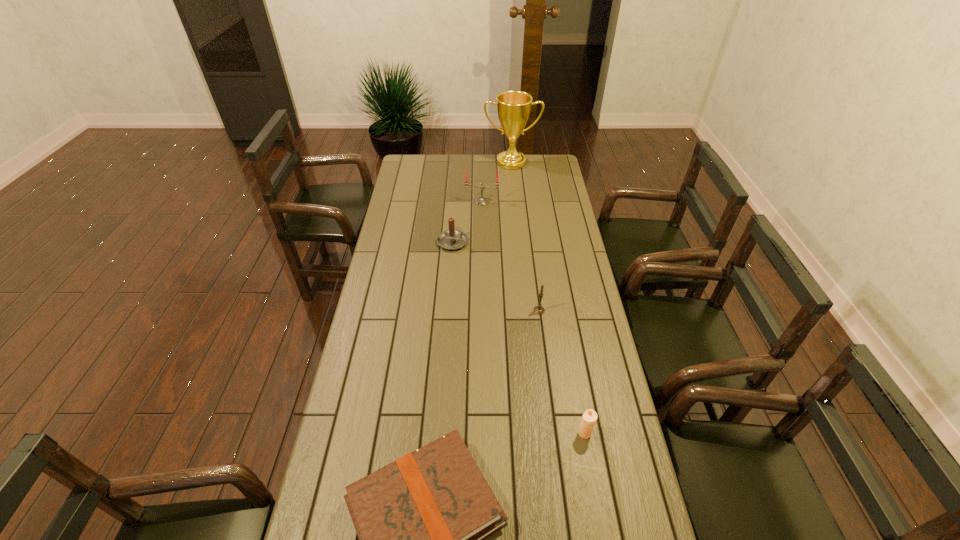
The height and width of the screenshot is (540, 960). In order to click on vacant position at the left edge of the desktop in this screenshot , I will do `click(345, 387)`.

At what (x,y) coordinates should I click in order to perform the action: click on free space at the right edge of the desktop. Please return your answer as a coordinate pair (x, y). The width and height of the screenshot is (960, 540). Looking at the image, I should click on (567, 354).

Identify the location of empty location between the fifth shortest object and the nearest candle. The width and height of the screenshot is (960, 540). (534, 318).

Locate an element on the screen. free space between the fourth farthest object and the farthest object is located at coordinates (525, 237).

Where is `free space between the award and the fifth shortest object`? free space between the award and the fifth shortest object is located at coordinates (496, 182).

You are a GUI agent. You are given a task and a screenshot of the screen. Output one action in this format:
    pyautogui.click(x=<x>, y=<y>)
    Task: Click on the blank region between the rightmost candle and the third nearest object
    
    Given the screenshot: What is the action you would take?
    pyautogui.click(x=562, y=372)

Identify the location of unoccupied position between the second nearest candle and the third nearest candle. [x=495, y=276].

In order to click on vacant area that lies between the nearest candle and the tallest object in this screenshot , I will do pos(548,298).

Locate an element on the screen. The height and width of the screenshot is (540, 960). blank region between the nearest candle and the second nearest candle is located at coordinates (562, 372).

Identify which object is located as the fourth nearest to the fourth farthest object. Please provide its 2D coordinates. Your answer should be formatted as a tuple, i.e. [(x, y)], where the tuple contains the x and y coordinates of a point satisfying the conditions above.

[(481, 200)]